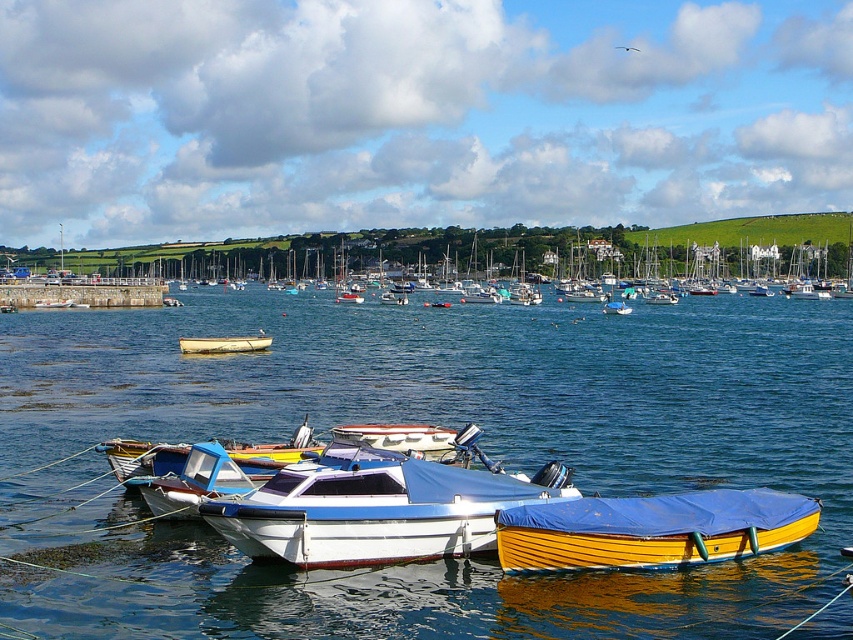
You are planning to load a heavy cargo onto the yellow wood boat at lower right and the white plastic boat at center. Based on their sizes, which boat can accommodate more cargo?

The white plastic boat at center is taller than the yellow wood boat at lower right, so it can accommodate more cargo.

You are a boat operator who needs to navigate a 20 meter long cargo ship through the marina. The cargo ship requires a minimum of 20 meters of clearance to safely pass between the blue water at center and the white glossy motorboat at center. Based on the scene description, can the cargo ship safely navigate this path?

The distance between the blue water at center and the white glossy motorboat at center is 24.43 meters. Since the cargo ship requires a minimum of 20 meters of clearance, the 24.43 meters available is sufficient. Therefore, the cargo ship can safely navigate this path.

You are a photographer planning to take a photo of the white glossy motorboat at center from the dock. However, the blue water at center is blocking your view. Can you adjust your position to capture the motorboat without the water obstructing the shot?

The blue water at center is positioned over the white glossy motorboat at center, so adjusting your position to look underneath or around the water might be necessary to capture the motorboat without obstruction.